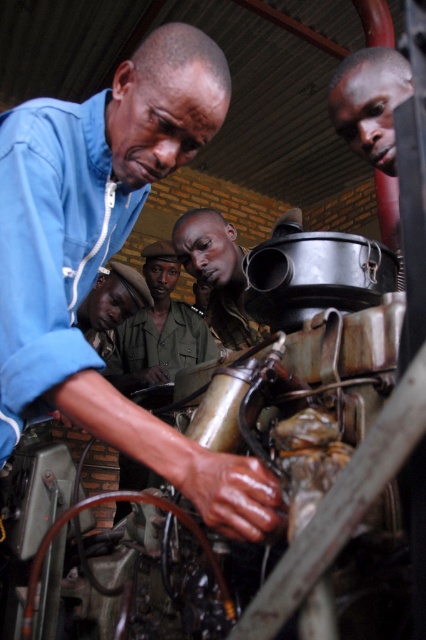
Question: Which object is closer to the camera taking this photo?

Choices:
 (A) green uniform at center
 (B) metallic gray pipe at center
 (C) blue matte shirt at upper left

Answer: (C)

Question: Can you confirm if green uniform at center is smaller than metallic gray pipe at center?

Choices:
 (A) yes
 (B) no

Answer: (B)

Question: Which point is closer to the camera?

Choices:
 (A) (365, 100)
 (B) (207, 232)
 (C) (120, 337)
 (D) (89, 252)

Answer: (D)

Question: Estimate the real-world distances between objects in this image. Which object is farther from the metallic gray pipe at center?

Choices:
 (A) blue matte shirt at upper left
 (B) smooth skin face at upper right
 (C) green uniform at center

Answer: (B)

Question: Is blue matte shirt at upper left closer to camera compared to smooth skin face at upper right?

Choices:
 (A) yes
 (B) no

Answer: (A)

Question: Can you confirm if green uniform at center is positioned to the right of smooth skin face at upper right?

Choices:
 (A) no
 (B) yes

Answer: (A)